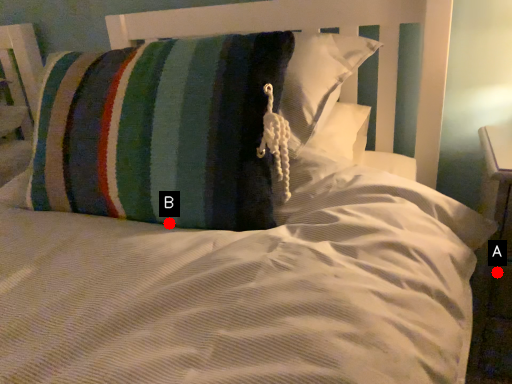
Question: Two points are circled on the image, labeled by A and B beside each circle. Among these points, which one is farthest from the camera?

Choices:
 (A) A is further
 (B) B is further

Answer: (A)